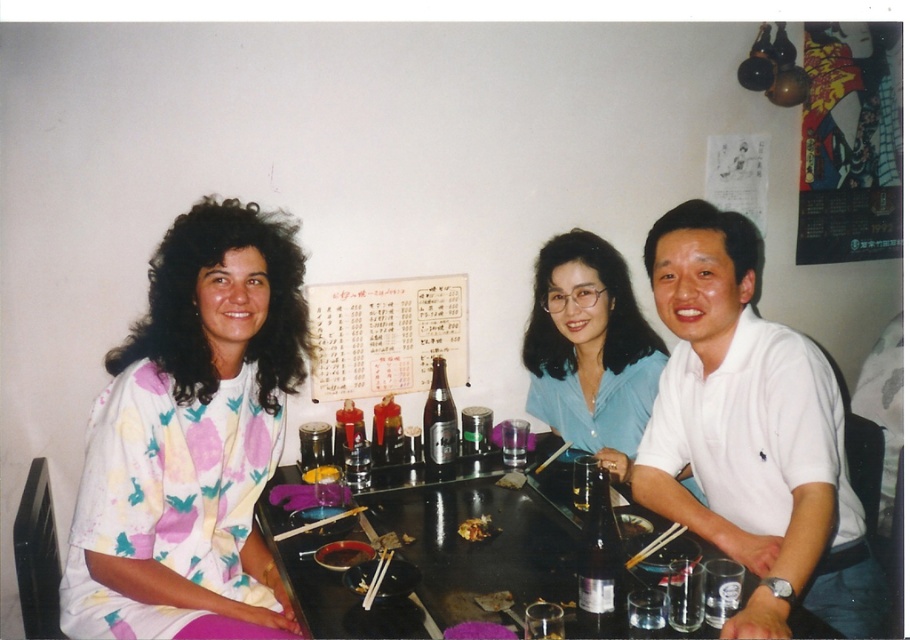
Question: Based on their relative distances, which object is farther from the white paper menu at center?

Choices:
 (A) thick brown sauce at center
 (B) brown crispy noodles at center
 (C) wooden chopsticks at center

Answer: (C)

Question: Is thick brown sauce at center positioned in front of wooden chopsticks at center?

Choices:
 (A) yes
 (B) no

Answer: (B)

Question: Which object appears farthest from the camera in this image?

Choices:
 (A) white paper menu at center
 (B) wooden chopsticks at center
 (C) white cotton shirt at right

Answer: (A)

Question: Is the position of white cotton shirt at right more distant than that of white paper menu at center?

Choices:
 (A) yes
 (B) no

Answer: (B)

Question: Which point is farther to the camera?

Choices:
 (A) (460, 532)
 (B) (682, 449)

Answer: (B)

Question: Does wooden chopsticks at center have a smaller size compared to yellow matte rice at center?

Choices:
 (A) no
 (B) yes

Answer: (A)